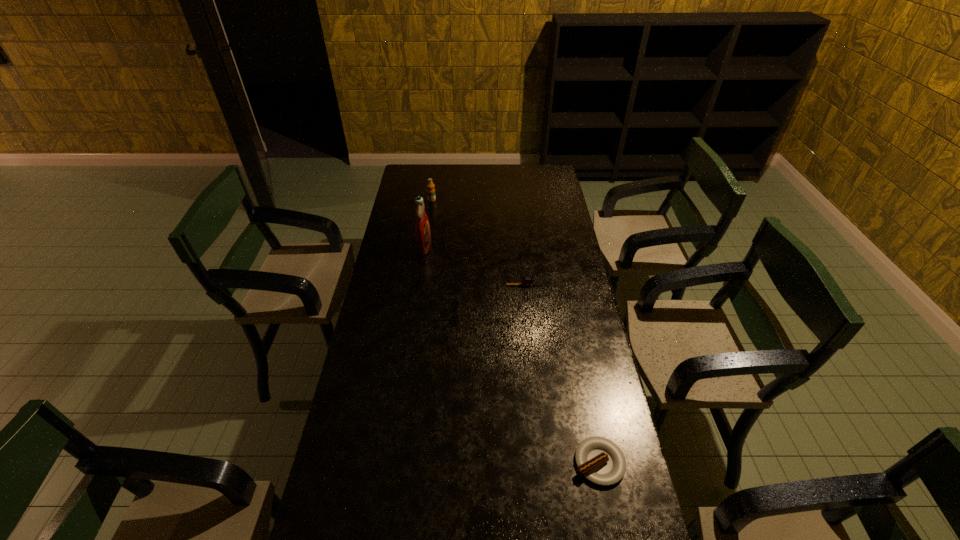
Where is `empty space that is in between the fourth farthest object and the second object from right to left`? This screenshot has width=960, height=540. empty space that is in between the fourth farthest object and the second object from right to left is located at coordinates (486, 298).

Where is `the closest object to the sausage`? This screenshot has height=540, width=960. the closest object to the sausage is located at coordinates (442, 292).

Identify which object is located as the second nearest to the nearest object. Please provide its 2D coordinates. Your answer should be formatted as a tuple, i.e. [(x, y)], where the tuple contains the x and y coordinates of a point satisfying the conditions above.

[(526, 281)]

Image resolution: width=960 pixels, height=540 pixels. What are the coordinates of `vacant space that satisfies the following two spatial constraints: 1. on the label of the orange juice; 2. on the left side of the third nearest object` in the screenshot? It's located at (420, 285).

At what (x,y) coordinates should I click in order to perform the action: click on free location that satisfies the following two spatial constraints: 1. on the front-facing side of the nearest object; 2. on the left side of the fourth farthest object. Please return your answer as a coordinate pair (x, y). This screenshot has height=540, width=960. Looking at the image, I should click on (435, 462).

This screenshot has width=960, height=540. Identify the location of free space in the image that satisfies the following two spatial constraints: 1. on the label of the second tallest object; 2. on the left side of the tape measure. (420, 285).

This screenshot has width=960, height=540. What are the coordinates of `free region that satisfies the following two spatial constraints: 1. on the front side of the sausage; 2. on the left side of the tape measure` in the screenshot? It's located at (544, 462).

Locate an element on the screen. blank space that satisfies the following two spatial constraints: 1. on the label of the farthest object; 2. on the left side of the second object from right to left is located at coordinates (420, 285).

You are a GUI agent. You are given a task and a screenshot of the screen. Output one action in this format:
    pyautogui.click(x=<x>, y=<y>)
    Task: Click on the free location that satisfies the following two spatial constraints: 1. on the front surface of the detergent; 2. on the right side of the third nearest object
    The height and width of the screenshot is (540, 960).
    Given the screenshot: What is the action you would take?
    pyautogui.click(x=419, y=285)

Where is `vacant space that satisfies the following two spatial constraints: 1. on the label of the orange juice; 2. on the left side of the sausage`? Image resolution: width=960 pixels, height=540 pixels. vacant space that satisfies the following two spatial constraints: 1. on the label of the orange juice; 2. on the left side of the sausage is located at coordinates (395, 462).